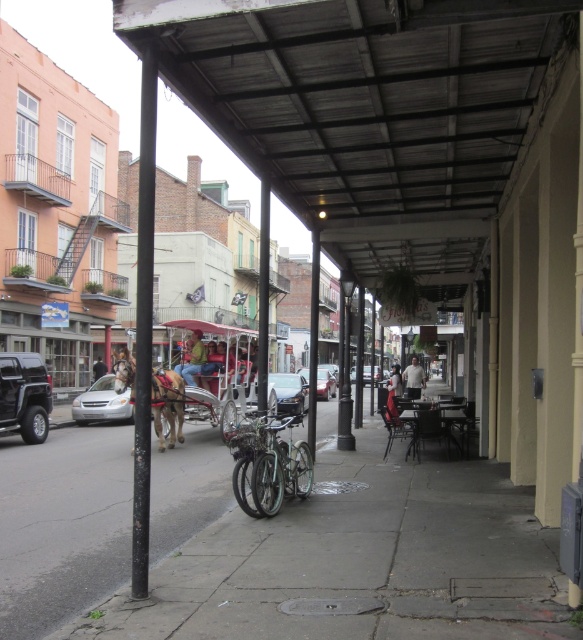
Who is positioned more to the left, black metal pole at left or metallic silver sedan at center?

black metal pole at left

Does black metal pole at left appear on the right side of metallic silver sedan at center?

Incorrect, black metal pole at left is not on the right side of metallic silver sedan at center.

I want to click on black metal pole at left, so point(143,323).

Between shiny silver car at center and metallic silver car at center, which one appears on the left side from the viewer's perspective?

shiny silver car at center

Between point (283, 408) and point (317, 371), which one is positioned in front?

Point (283, 408) is in front.

Locate an element on the screen. shiny silver car at center is located at coordinates (289, 392).

Which is more to the right, gray concrete pavement at center or dark brown leather jacket at center?

Positioned to the right is gray concrete pavement at center.

Between gray concrete pavement at center and dark brown leather jacket at center, which one has less height?

dark brown leather jacket at center

Where is `gray concrete pavement at center`? gray concrete pavement at center is located at coordinates (265, 541).